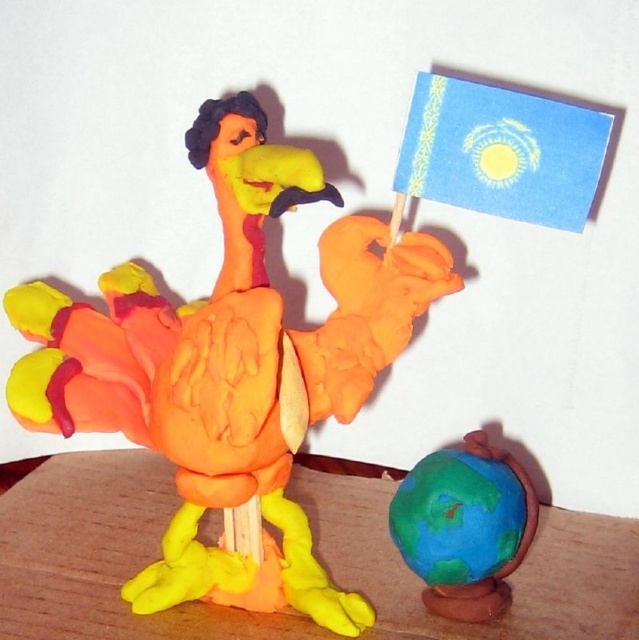
Question: Does wooden table at lower center appear over earth-like clay globe at lower right?

Choices:
 (A) no
 (B) yes

Answer: (A)

Question: Does wooden table at lower center lie behind earth-like clay globe at lower right?

Choices:
 (A) no
 (B) yes

Answer: (A)

Question: Does matte clay bird at center appear under earth-like clay globe at lower right?

Choices:
 (A) yes
 (B) no

Answer: (B)

Question: Which point is closer to the camera?

Choices:
 (A) (571, 116)
 (B) (450, 496)
 (C) (265, 356)

Answer: (A)

Question: Considering the real-world distances, which object is farthest from the earth-like clay globe at lower right?

Choices:
 (A) matte clay bird at center
 (B) blue paper flag at upper right

Answer: (B)

Question: Which object is positioned farthest from the wooden table at lower center?

Choices:
 (A) earth-like clay globe at lower right
 (B) blue paper flag at upper right

Answer: (B)